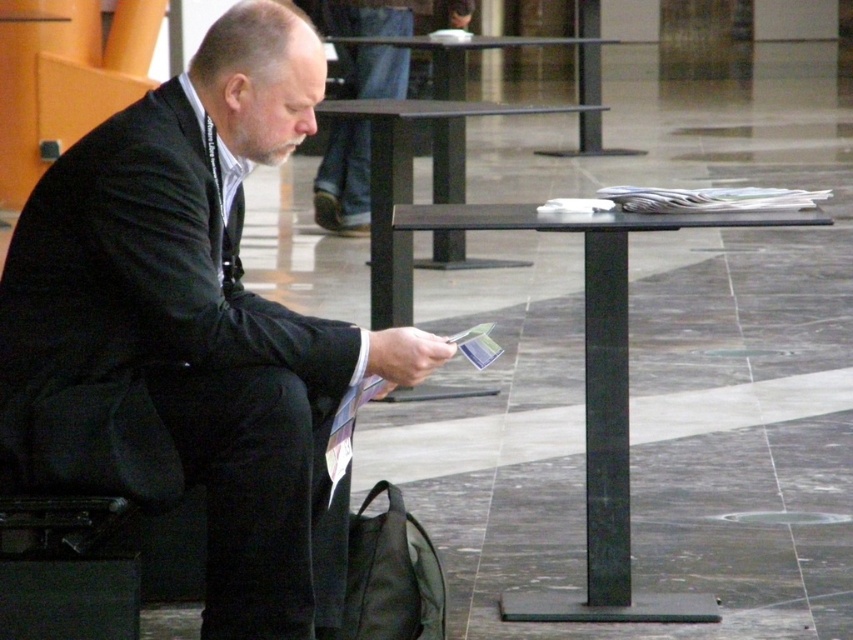
Question: Is matte black suit at center positioned before black metal table at center?

Choices:
 (A) yes
 (B) no

Answer: (A)

Question: Among these points, which one is farthest from the camera?

Choices:
 (A) (440, 577)
 (B) (589, 364)
 (C) (421, 348)

Answer: (B)

Question: Which is farther from the black fabric bag at lower left?

Choices:
 (A) black glass table at center
 (B) matte black suit at center

Answer: (A)

Question: Is black metal table at center closer to camera compared to black glass table at center?

Choices:
 (A) no
 (B) yes

Answer: (B)

Question: Is matte black suit at center positioned before black metal table at center?

Choices:
 (A) yes
 (B) no

Answer: (A)

Question: Which point is closer to the camera taking this photo?

Choices:
 (A) (186, 304)
 (B) (437, 212)
 (C) (386, 170)

Answer: (A)